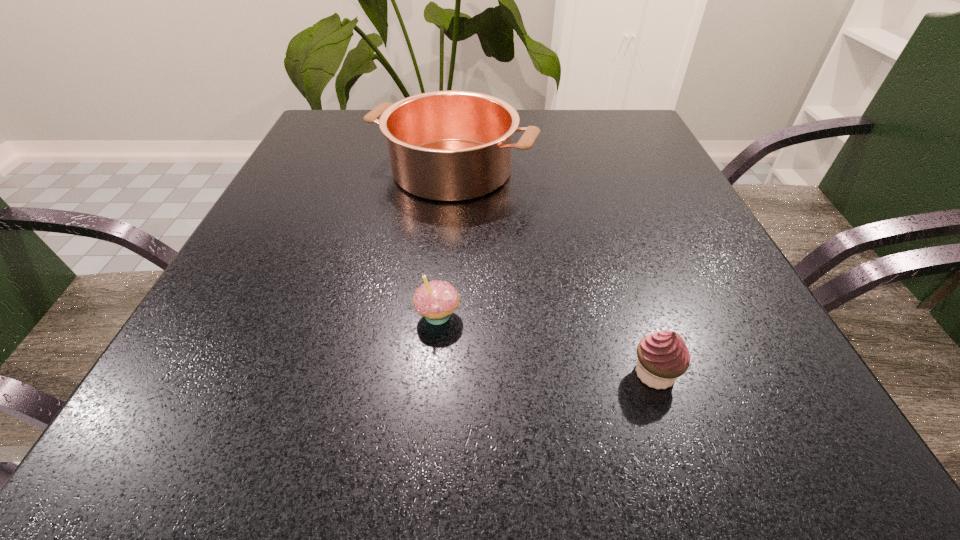
The width and height of the screenshot is (960, 540). Identify the location of vacant space that satisfies the following two spatial constraints: 1. on the back side of the second farthest object; 2. on the right side of the tallest object. (451, 170).

Where is `free point that satisfies the following two spatial constraints: 1. on the back side of the tallest object; 2. on the left side of the second nearest object`? The height and width of the screenshot is (540, 960). free point that satisfies the following two spatial constraints: 1. on the back side of the tallest object; 2. on the left side of the second nearest object is located at coordinates (451, 170).

I want to click on vacant point that satisfies the following two spatial constraints: 1. on the front side of the nearer cupcake; 2. on the left side of the saucepan, so click(434, 373).

Find the location of a particular element. This screenshot has width=960, height=540. vacant position in the image that satisfies the following two spatial constraints: 1. on the back side of the farther cupcake; 2. on the left side of the farthest object is located at coordinates (451, 170).